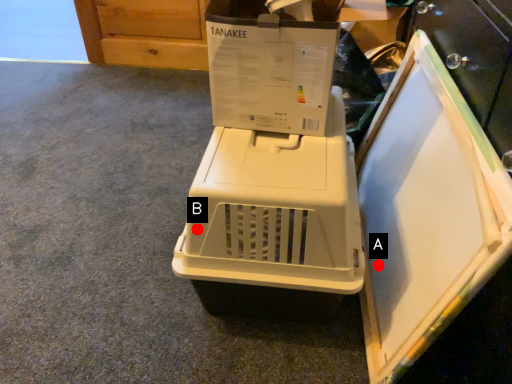
Question: Two points are circled on the image, labeled by A and B beside each circle. Which point appears farthest from the camera in this image?

Choices:
 (A) A is further
 (B) B is further

Answer: (A)